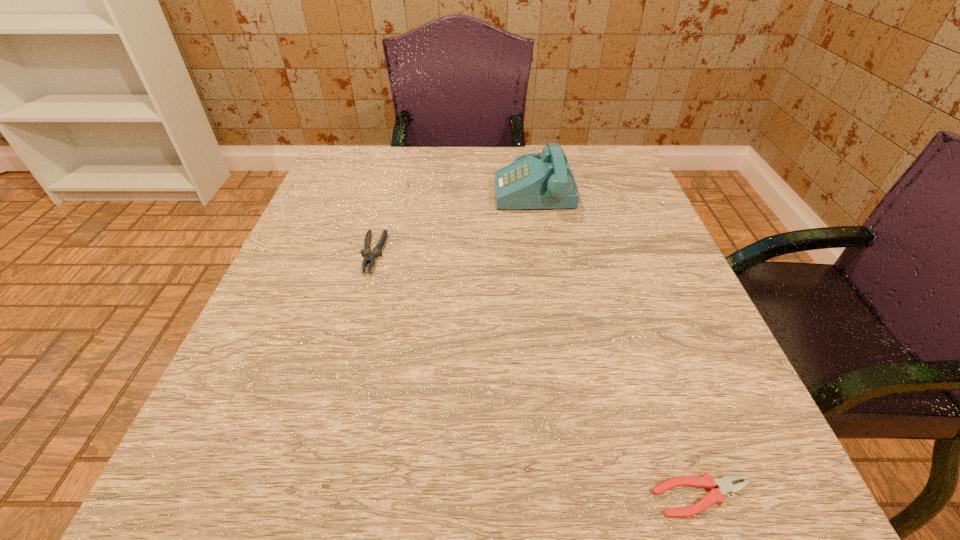
The height and width of the screenshot is (540, 960). I want to click on vacant space that satisfies the following two spatial constraints: 1. on the dial of the nearer pliers; 2. on the left side of the tallest object, so click(584, 497).

Identify the location of free space that satisfies the following two spatial constraints: 1. on the dial of the telephone; 2. at the gripping part of the left pliers. The height and width of the screenshot is (540, 960). (543, 253).

The width and height of the screenshot is (960, 540). What are the coordinates of `vacant space that satisfies the following two spatial constraints: 1. at the gripping part of the taller pliers; 2. on the right side of the shorter pliers` in the screenshot? It's located at (306, 497).

Image resolution: width=960 pixels, height=540 pixels. Identify the location of free space that satisfies the following two spatial constraints: 1. on the dial of the tallest object; 2. at the gripping part of the left pliers. (543, 253).

Image resolution: width=960 pixels, height=540 pixels. Identify the location of vacant region that satisfies the following two spatial constraints: 1. at the gripping part of the right pliers; 2. on the right side of the taller pliers. (306, 497).

Find the location of a particular element. The width and height of the screenshot is (960, 540). blank space that satisfies the following two spatial constraints: 1. at the gripping part of the shorter pliers; 2. on the left side of the second tallest object is located at coordinates (306, 497).

This screenshot has width=960, height=540. Find the location of `vacant region that satisfies the following two spatial constraints: 1. on the dial of the farthest object; 2. at the gripping part of the leftmost object`. vacant region that satisfies the following two spatial constraints: 1. on the dial of the farthest object; 2. at the gripping part of the leftmost object is located at coordinates (543, 253).

Where is `vacant space that satisfies the following two spatial constraints: 1. on the dial of the telephone; 2. at the gripping part of the second tallest object`? vacant space that satisfies the following two spatial constraints: 1. on the dial of the telephone; 2. at the gripping part of the second tallest object is located at coordinates (543, 253).

Locate an element on the screen. This screenshot has height=540, width=960. vacant space that satisfies the following two spatial constraints: 1. on the dial of the tallest object; 2. at the gripping part of the taller pliers is located at coordinates (543, 253).